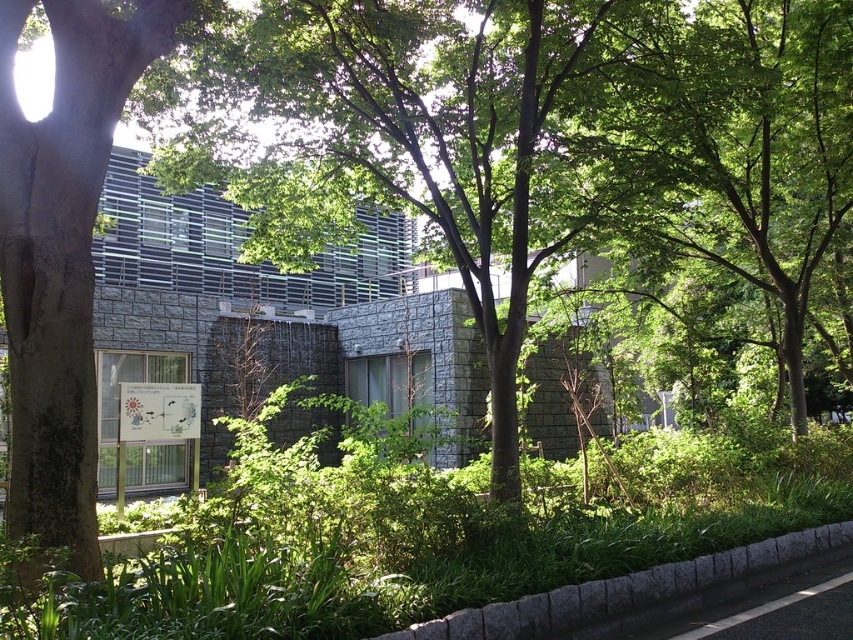
Does green leafy tree at center have a greater height compared to gray concrete curb at lower center?

Indeed, green leafy tree at center has a greater height compared to gray concrete curb at lower center.

Is point (370, 45) closer to camera compared to point (473, 611)?

No.

Identify the location of green leafy tree at center. (415, 138).

Which is more to the right, green leafy tree at left or gray concrete curb at lower center?

Positioned to the right is gray concrete curb at lower center.

Does point (54, 147) come behind point (738, 579)?

No, it is not.

Does point (85, 474) come in front of point (467, 618)?

No, (85, 474) is further to viewer.

This screenshot has height=640, width=853. Identify the location of green leafy tree at left. (64, 252).

Can you confirm if green leafy tree at center is positioned below green leafy tree at left?

No, green leafy tree at center is not below green leafy tree at left.

Who is more distant from viewer, (498, 244) or (86, 419)?

The point (498, 244) is more distant.

The width and height of the screenshot is (853, 640). Find the location of `green leafy tree at center`. green leafy tree at center is located at coordinates (415, 138).